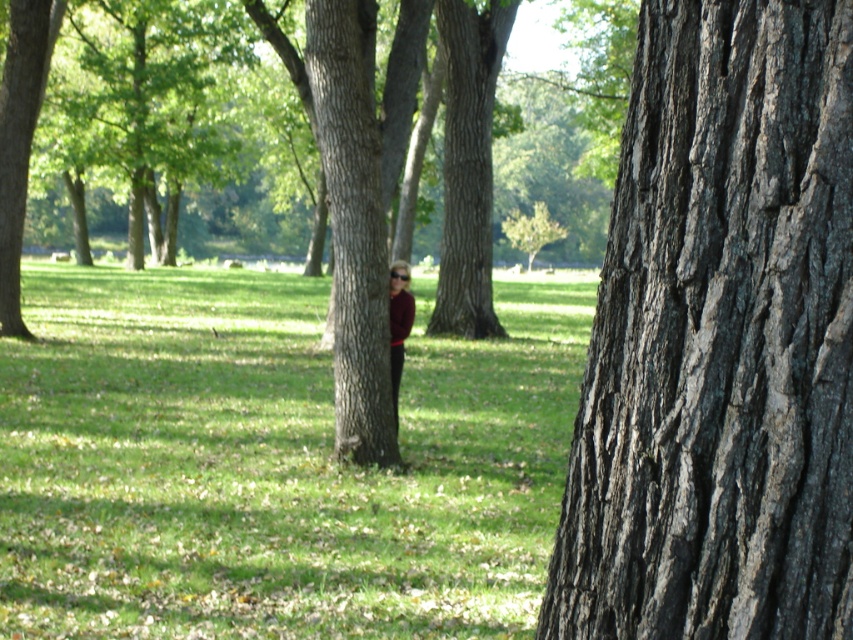
Question: Does brown rough tree trunk at center have a larger size compared to maroon shirt at center?

Choices:
 (A) yes
 (B) no

Answer: (A)

Question: Which point is farther from the camera taking this photo?

Choices:
 (A) (561, 364)
 (B) (357, 429)
 (C) (402, 305)
 (D) (715, 138)

Answer: (A)

Question: Among these objects, which one is farthest from the camera?

Choices:
 (A) green grass at center
 (B) brown rough tree trunk at center
 (C) maroon shirt at center

Answer: (C)

Question: Among these points, which one is farthest from the camera?

Choices:
 (A) (397, 301)
 (B) (207, 515)
 (C) (752, 566)

Answer: (A)

Question: From the image, what is the correct spatial relationship of green grass at center in relation to maroon shirt at center?

Choices:
 (A) below
 (B) above

Answer: (A)

Question: Is green grass at center to the left of maroon shirt at center from the viewer's perspective?

Choices:
 (A) yes
 (B) no

Answer: (A)